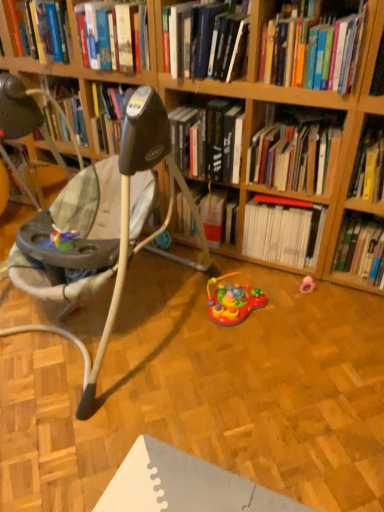
Question: Does pink rubber pacifier at lower right, the second toy from the left, have a greater height compared to hardcover book at center, which is counted as the fifth book, starting from the left?

Choices:
 (A) yes
 (B) no

Answer: (B)

Question: From the image's perspective, would you say pink rubber pacifier at lower right, the second toy from the left, is shown under hardcover book at center, the fourth book viewed from the right?

Choices:
 (A) no
 (B) yes

Answer: (B)

Question: From a real-world perspective, is pink rubber pacifier at lower right, which is the first toy from right to left, located higher than hardcover book at center, which is counted as the fifth book, starting from the left?

Choices:
 (A) no
 (B) yes

Answer: (A)

Question: Is pink rubber pacifier at lower right, the second toy from the left, at the left side of hardcover book at center, which is counted as the fifth book, starting from the left?

Choices:
 (A) yes
 (B) no

Answer: (B)

Question: Is pink rubber pacifier at lower right, the second toy from the left, wider than hardcover book at center, the fourth book viewed from the right?

Choices:
 (A) no
 (B) yes

Answer: (A)

Question: Does pink rubber pacifier at lower right, which is the first toy from right to left, have a lesser width compared to hardcover book at center, the fourth book viewed from the right?

Choices:
 (A) no
 (B) yes

Answer: (B)

Question: Can we say multicolored plastic toy at center, marked as the second toy in a right-to-left arrangement, lies outside hardcover book at center, the fourth book viewed from the right?

Choices:
 (A) no
 (B) yes

Answer: (B)

Question: Is multicolored plastic toy at center, marked as the second toy in a right-to-left arrangement, at the left side of hardcover book at center, which is counted as the fifth book, starting from the left?

Choices:
 (A) no
 (B) yes

Answer: (B)

Question: Are multicolored plastic toy at center, the 1th toy viewed from the left, and hardcover book at center, which is counted as the fifth book, starting from the left, far apart?

Choices:
 (A) no
 (B) yes

Answer: (A)

Question: Is multicolored plastic toy at center, the 1th toy viewed from the left, positioned with its back to hardcover book at center, the fourth book viewed from the right?

Choices:
 (A) no
 (B) yes

Answer: (A)

Question: Is hardcover book at center, the fourth book viewed from the right, located within multicolored plastic toy at center, marked as the second toy in a right-to-left arrangement?

Choices:
 (A) yes
 (B) no

Answer: (B)

Question: Is multicolored plastic toy at center, marked as the second toy in a right-to-left arrangement, bigger than hardcover book at center, which is counted as the fifth book, starting from the left?

Choices:
 (A) no
 (B) yes

Answer: (A)

Question: Can you confirm if yellow paper at upper right, which is the second book from right to left, is positioned to the right of beige fabric baby swing at left?

Choices:
 (A) no
 (B) yes

Answer: (B)